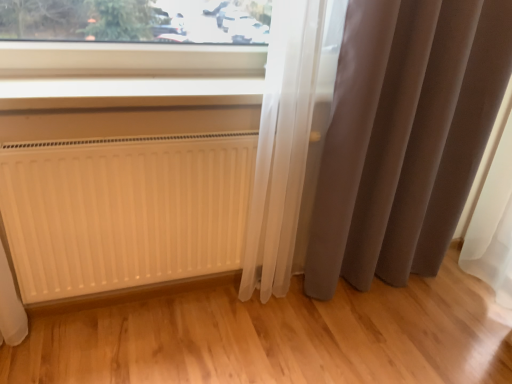
This screenshot has width=512, height=384. Identify the location of vacant space situated above white matte radiator at lower left (from a real-world perspective). (130, 139).